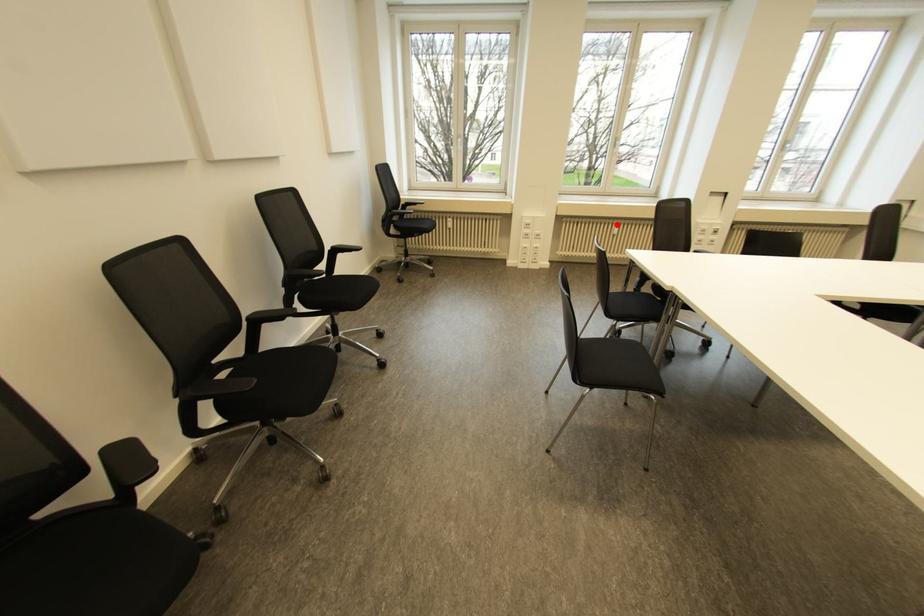
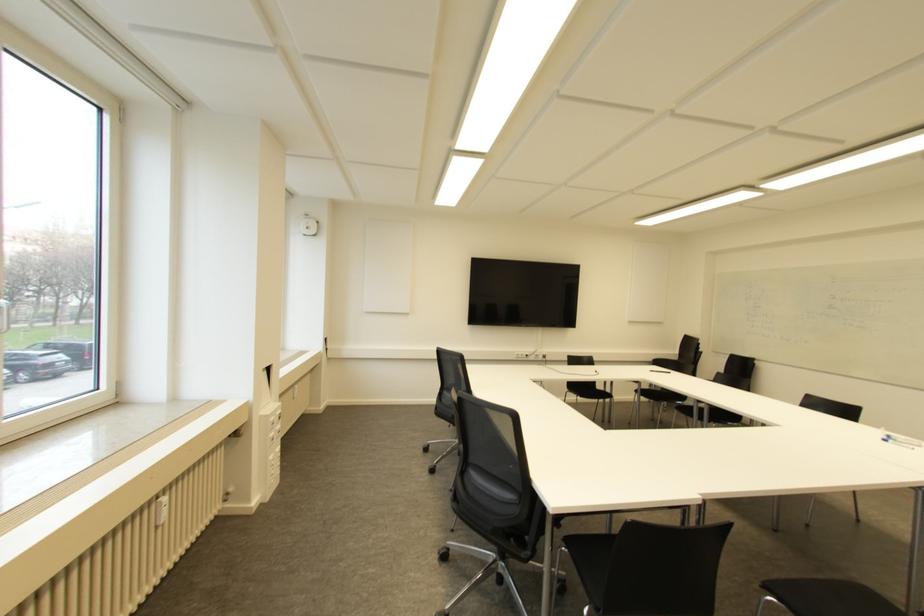
Question: I am providing you with two images of the same scene from different viewpoints. Given a red point in image1, look at the same physical point in image2. Is it:

Choices:
 (A) Closer to the viewpoint
 (B) Farther from the viewpoint

Answer: (A)